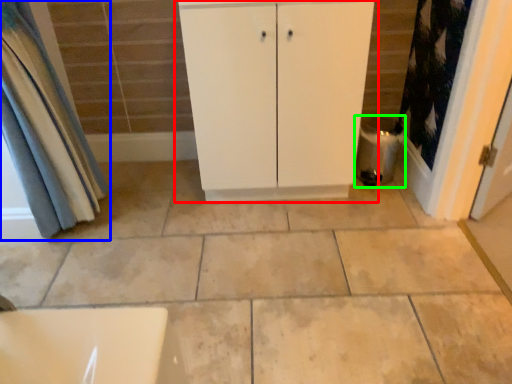
Question: Which object is positioned farthest from bathroom cabinet (highlighted by a red box)? Select from curtain (highlighted by a blue box) and water heater (highlighted by a green box).

Choices:
 (A) curtain
 (B) water heater

Answer: (A)